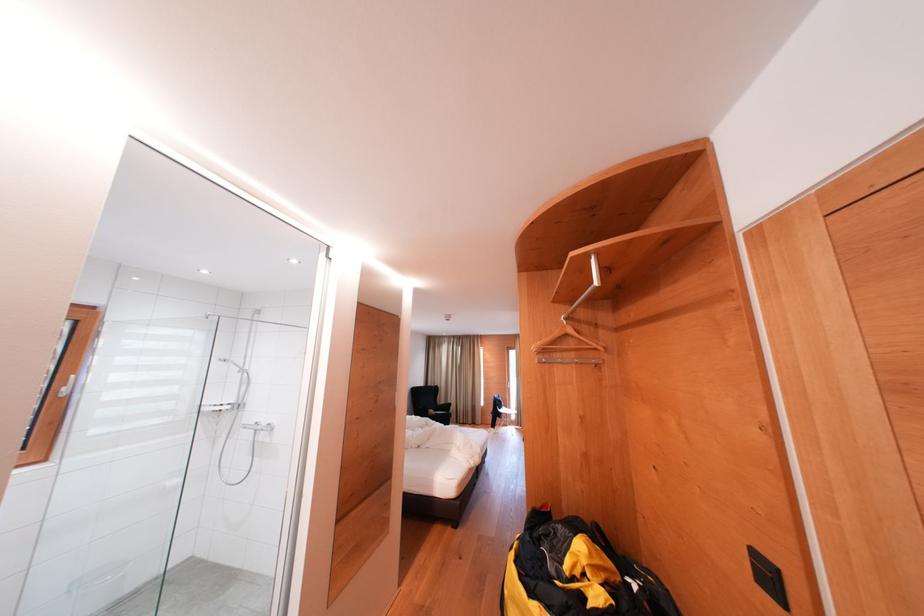
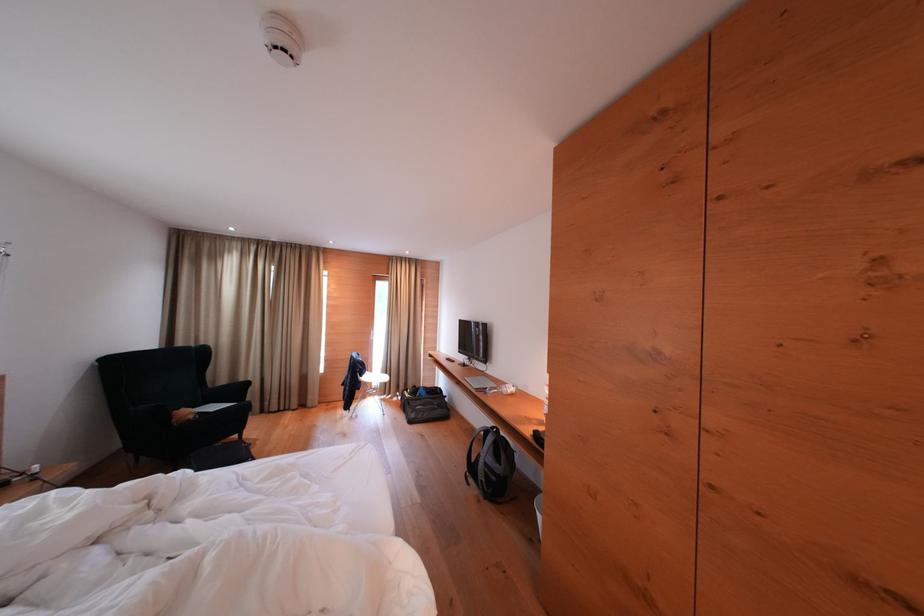
Find the pixel in the second image that matches the point at 517,416 in the first image.

(383, 379)